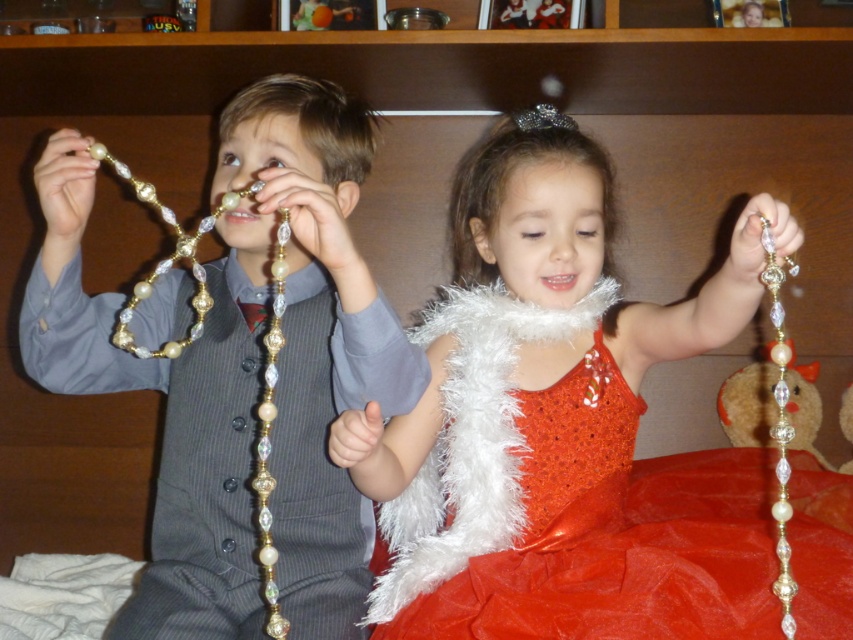
You are a photographer setting up a shot of the two children. The matte gold necklace at left is an important element. Where should you position your camera to ensure it is in the frame?

Position the camera so that it captures the area around point (242,369) where the matte gold necklace at left is located.

You are standing at the point marked as point (502, 214) in the image. The boy on the left is holding a beaded necklace that extends towards the right side of the frame. Can you reach the boy on the left without moving from your current position?

The distance between you and the boy on the left is 3.76 feet. Since you are at point (502, 214) and the boy is holding the necklace towards the right, you are 3.76 feet away from him. Whether you can reach him depends on your arm length, but the question doesn

You are a parent standing at the point marked by the coordinate point at (305,518). You want to hand a toy to the child who is closer to you. Which child should you give the toy to?

The children are 1.11 meters apart, so you should give the toy to the child closer to the point at (305,518).